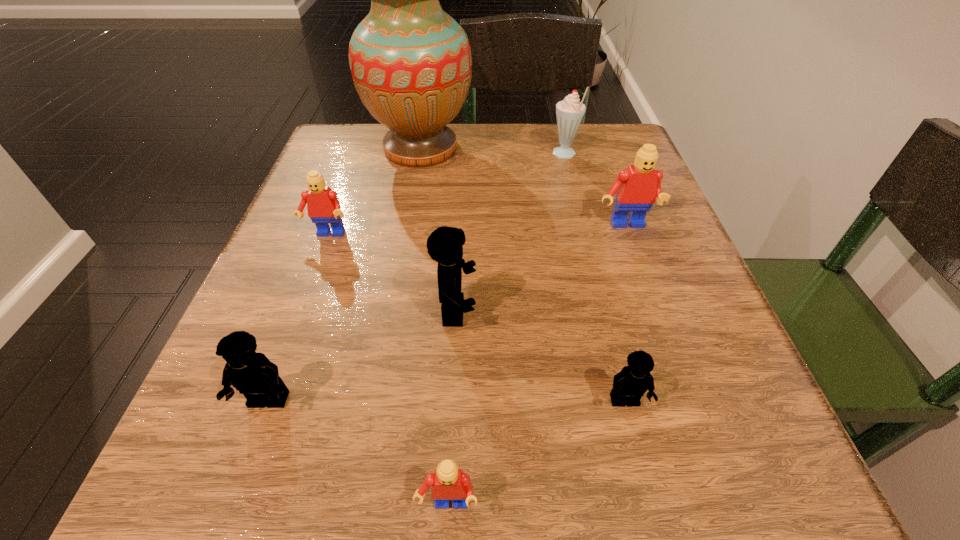
This screenshot has width=960, height=540. I want to click on vacant area that satisfies the following two spatial constraints: 1. on the straw side of the milkshake; 2. on the front-facing side of the leftmost red Lego, so click(585, 235).